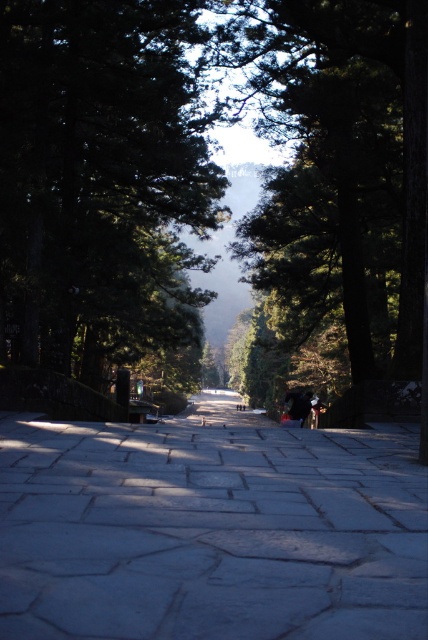
You are a gardener planning to install a new walkway between the gray stone pavement at center and the green textured tree at center. Considering their widths, which one is narrower?

The gray stone pavement at center is narrower than the green textured tree at center.

You are a landscape architect designing a walking path. You need to ensure that the gray stone pavement at center is at least 15 meters away from the green textured tree at center for safety reasons. Based on the image provided, does the current placement meet this requirement?

The gray stone pavement at center is 15.68 meters away from the green textured tree at center, which exceeds the required 15 meters, so the placement meets the safety requirement.